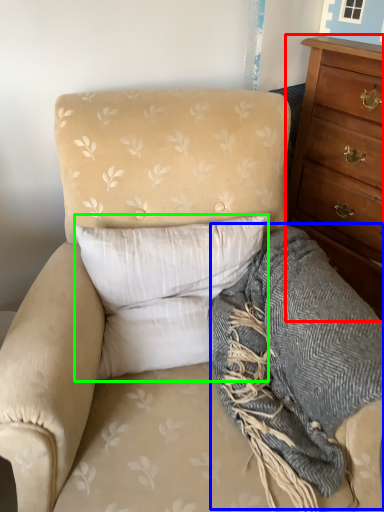
Question: Based on their relative distances, which object is nearer to chest of drawers (highlighted by a red box)? Choose from blanket (highlighted by a blue box) and pillow (highlighted by a green box).

Choices:
 (A) blanket
 (B) pillow

Answer: (A)